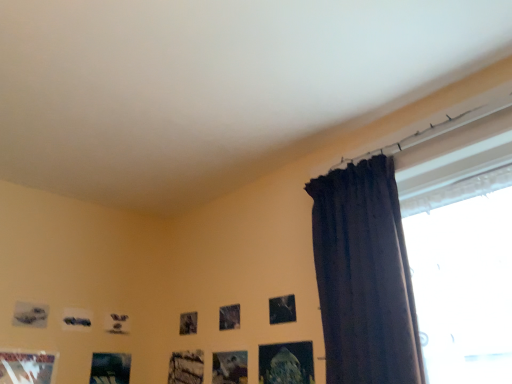
Question: Can you confirm if matte gray picture frame at lower left, arranged as the 7th picture frame when viewed from the right, is positioned to the left of metallic silver picture frame at upper center, which appears as the 2th picture frame when viewed from the right?

Choices:
 (A) no
 (B) yes

Answer: (B)

Question: Considering the relative sizes of matte gray picture frame at lower left, the first picture frame in the left-to-right sequence, and metallic silver picture frame at upper center, which appears as the 2th picture frame when viewed from the right, in the image provided, is matte gray picture frame at lower left, the first picture frame in the left-to-right sequence, shorter than metallic silver picture frame at upper center, which appears as the 2th picture frame when viewed from the right,?

Choices:
 (A) yes
 (B) no

Answer: (A)

Question: Considering the relative sizes of matte gray picture frame at lower left, the first picture frame in the left-to-right sequence, and metallic silver picture frame at upper center, arranged as the sixth picture frame when viewed from the left, in the image provided, is matte gray picture frame at lower left, the first picture frame in the left-to-right sequence, wider than metallic silver picture frame at upper center, arranged as the sixth picture frame when viewed from the left,?

Choices:
 (A) yes
 (B) no

Answer: (A)

Question: Can you see matte gray picture frame at lower left, the first picture frame in the left-to-right sequence, touching metallic silver picture frame at upper center, which appears as the 2th picture frame when viewed from the right?

Choices:
 (A) no
 (B) yes

Answer: (A)

Question: From a real-world perspective, is matte gray picture frame at lower left, the first picture frame in the left-to-right sequence, below metallic silver picture frame at upper center, arranged as the sixth picture frame when viewed from the left?

Choices:
 (A) no
 (B) yes

Answer: (A)

Question: From the image's perspective, is metallic silver picture frame at lower left, the 2th picture frame in the left-to-right sequence, above or below wooden frame at lower center, arranged as the fourth picture frame when viewed from the right?

Choices:
 (A) below
 (B) above

Answer: (B)

Question: Considering their positions, is metallic silver picture frame at lower left, the 6th picture frame in the right-to-left sequence, located in front of or behind wooden frame at lower center, which is the 4th picture frame from left to right?

Choices:
 (A) behind
 (B) front

Answer: (B)

Question: Is metallic silver picture frame at lower left, the 2th picture frame in the left-to-right sequence, situated inside wooden frame at lower center, which is the 4th picture frame from left to right, or outside?

Choices:
 (A) inside
 (B) outside

Answer: (B)

Question: Is point (10, 364) closer or farther from the camera than point (188, 380)?

Choices:
 (A) closer
 (B) farther

Answer: (A)

Question: From a real-world perspective, relative to dark fabric curtain at right, is metallic silver picture frame at lower center, the 5th picture frame when ordered from left to right, vertically above or below?

Choices:
 (A) above
 (B) below

Answer: (B)

Question: From the image's perspective, is metallic silver picture frame at lower center, the third picture frame in the right-to-left sequence, positioned above or below dark fabric curtain at right?

Choices:
 (A) below
 (B) above

Answer: (A)

Question: Considering their positions, is metallic silver picture frame at lower center, the 5th picture frame when ordered from left to right, located in front of or behind dark fabric curtain at right?

Choices:
 (A) behind
 (B) front

Answer: (A)

Question: From their relative heights in the image, would you say metallic silver picture frame at lower center, the 5th picture frame when ordered from left to right, is taller or shorter than dark fabric curtain at right?

Choices:
 (A) tall
 (B) short

Answer: (B)

Question: Does point (287, 322) appear closer or farther from the camera than point (35, 304)?

Choices:
 (A) farther
 (B) closer

Answer: (B)

Question: From a real-world perspective, is metallic silver picture frame at upper center, arranged as the sixth picture frame when viewed from the left, positioned above or below matte gray picture frame at lower left, the first picture frame in the left-to-right sequence?

Choices:
 (A) below
 (B) above

Answer: (A)